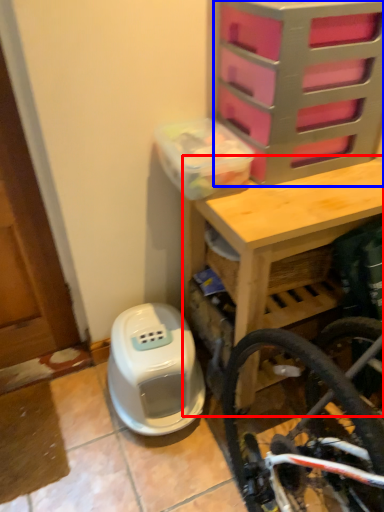
Question: Which object appears farthest to the camera in this image, table (highlighted by a red box) or drawer (highlighted by a blue box)?

Choices:
 (A) table
 (B) drawer

Answer: (A)